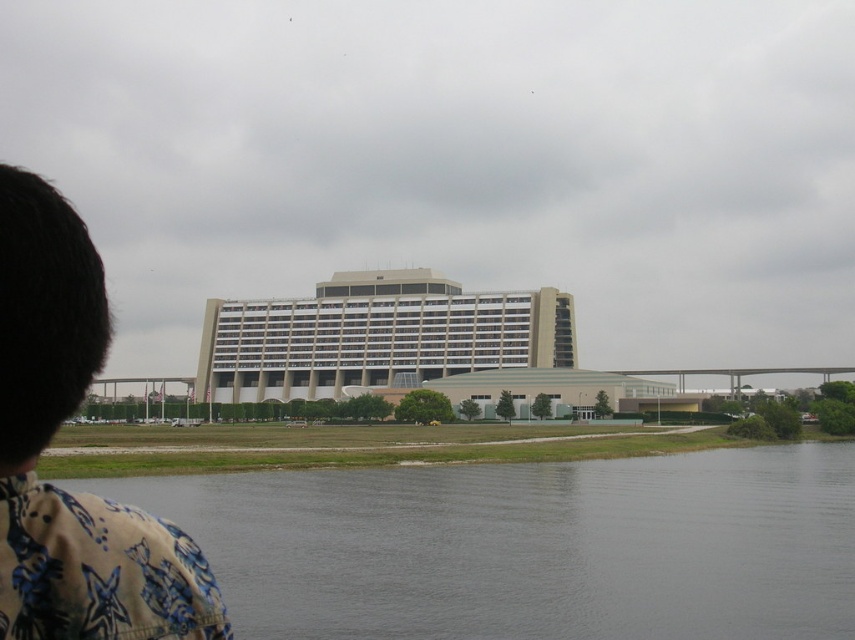
Question: Which of the following is the farthest from the observer?

Choices:
 (A) gray smooth water at lower center
 (B) brown fabric shirt at left

Answer: (A)

Question: Which of these objects is positioned farthest from the brown fabric shirt at left?

Choices:
 (A) beige concrete building at center
 (B) gray smooth water at lower center

Answer: (A)

Question: Can you confirm if gray smooth water at lower center is bigger than brown fabric shirt at left?

Choices:
 (A) yes
 (B) no

Answer: (A)

Question: Which of the following is the farthest from the observer?

Choices:
 (A) (325, 620)
 (B) (351, 292)
 (C) (6, 442)

Answer: (B)

Question: Can you confirm if gray smooth water at lower center is positioned above brown fabric shirt at left?

Choices:
 (A) no
 (B) yes

Answer: (A)

Question: Can you confirm if gray smooth water at lower center is positioned below brown fabric shirt at left?

Choices:
 (A) yes
 (B) no

Answer: (A)